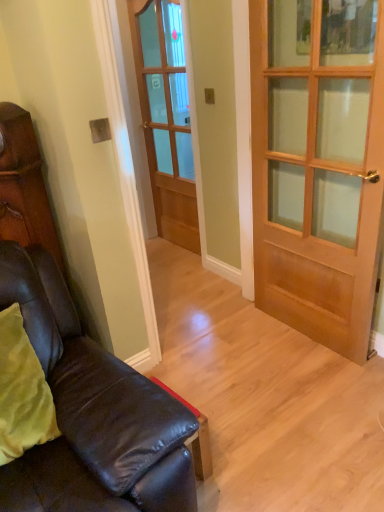
Identify the location of matte brown cabinet at left. The image size is (384, 512). (24, 186).

Measure the distance between wooden door at center, arranged as the first door when viewed from the front, and camera.

They are 5.27 feet apart.

How much space does wooden door at center, which is counted as the first door, starting from the right, occupy vertically?

The height of wooden door at center, which is counted as the first door, starting from the right, is 5.57 feet.

Measure the distance between wooden glass door at center, which is counted as the second door, starting from the right, and camera.

The distance of wooden glass door at center, which is counted as the second door, starting from the right, from camera is 2.80 meters.

Where is `leather couch at lower left`? The height and width of the screenshot is (512, 384). leather couch at lower left is located at coordinates (91, 412).

Is leather couch at lower left situated inside wooden door at center, arranged as the first door when viewed from the front, or outside?

leather couch at lower left is not inside wooden door at center, arranged as the first door when viewed from the front, it's outside.

How different are the orientations of leather couch at lower left and wooden door at center, arranged as the first door when viewed from the front, in degrees?

They differ by 88.8 degrees in their facing directions.

In terms of width, does leather couch at lower left look wider or thinner when compared to wooden door at center, arranged as the first door when viewed from the front?

Considering their sizes, leather couch at lower left looks broader than wooden door at center, arranged as the first door when viewed from the front.

Considering the points (26, 467) and (338, 284), which point is in front, point (26, 467) or point (338, 284)?

The point (26, 467) is closer to the camera.

Considering the sizes of objects wooden glass door at center, the first door from the back, and leather couch at lower left in the image provided, who is wider, wooden glass door at center, the first door from the back, or leather couch at lower left?

Wider between the two is leather couch at lower left.

Which object is more forward, wooden glass door at center, which is counted as the second door, starting from the right, or leather couch at lower left?

Positioned in front is leather couch at lower left.

Could you tell me if wooden glass door at center, the first door from the back, is turned towards leather couch at lower left?

No, wooden glass door at center, the first door from the back, is not turned towards leather couch at lower left.

Where is `door that is the 2nd one when counting backward from the leather couch at lower left`? The image size is (384, 512). door that is the 2nd one when counting backward from the leather couch at lower left is located at coordinates (166, 117).

What's the angular difference between leather couch at lower left and wooden glass door at center, which is counted as the second door, starting from the right,'s facing directions?

89.7 degrees separate the facing orientations of leather couch at lower left and wooden glass door at center, which is counted as the second door, starting from the right.

Does leather couch at lower left have a greater width compared to wooden glass door at center, positioned as the 2th door in front-to-back order?

Yes.

Is leather couch at lower left located outside wooden glass door at center, the first door from the back?

That's correct, leather couch at lower left is outside of wooden glass door at center, the first door from the back.

Which is behind, point (125, 505) or point (158, 228)?

The point (158, 228) is more distant.

Is wooden door at center, arranged as the first door when viewed from the front, positioned far away from wooden glass door at center, the first door in the left-to-right sequence?

wooden door at center, arranged as the first door when viewed from the front, is far away from wooden glass door at center, the first door in the left-to-right sequence.

Which is in front, point (363, 298) or point (145, 133)?

The point (363, 298) is in front.

Considering the relative sizes of wooden door at center, arranged as the second door when viewed from the back, and wooden glass door at center, the first door in the left-to-right sequence, in the image provided, is wooden door at center, arranged as the second door when viewed from the back, taller than wooden glass door at center, the first door in the left-to-right sequence,?

Incorrect, the height of wooden door at center, arranged as the second door when viewed from the back, is not larger of that of wooden glass door at center, the first door in the left-to-right sequence.

From a real-world perspective, who is located lower, wooden door at center, arranged as the second door when viewed from the back, or wooden glass door at center, the first door from the back?

In real-world perspective, wooden door at center, arranged as the second door when viewed from the back, is lower.

From a real-world perspective, is matte brown cabinet at left positioned above or below leather couch at lower left?

In terms of real-world spatial position, matte brown cabinet at left is above leather couch at lower left.

Which of these two, matte brown cabinet at left or leather couch at lower left, stands taller?

Standing taller between the two is matte brown cabinet at left.

Is matte brown cabinet at left placed right next to leather couch at lower left?

No, matte brown cabinet at left is not making contact with leather couch at lower left.

Can you confirm if matte brown cabinet at left is thinner than leather couch at lower left?

Yes.

Considering the sizes of objects matte brown cabinet at left and wooden glass door at center, which is counted as the second door, starting from the right, in the image provided, who is wider, matte brown cabinet at left or wooden glass door at center, which is counted as the second door, starting from the right,?

With larger width is matte brown cabinet at left.

Between matte brown cabinet at left and wooden glass door at center, positioned as the 2th door in front-to-back order, which one is positioned in front?

matte brown cabinet at left is more forward.

Does point (2, 153) appear closer or farther from the camera than point (174, 133)?

Point (2, 153).

Which is more to the left, matte brown cabinet at left or wooden glass door at center, the first door from the back?

matte brown cabinet at left.

In the image, is wooden door at center, arranged as the second door when viewed from the back, on the left side or the right side of matte brown cabinet at left?

wooden door at center, arranged as the second door when viewed from the back, is positioned on matte brown cabinet at left's right side.

At what (x,y) coordinates should I click in order to perform the action: click on the 1st door above the matte brown cabinet at left (from the image's perspective). Please return your answer as a coordinate pair (x, y). Looking at the image, I should click on (315, 177).

In terms of width, does wooden door at center, which is counted as the first door, starting from the right, look wider or thinner when compared to matte brown cabinet at left?

wooden door at center, which is counted as the first door, starting from the right, is thinner than matte brown cabinet at left.

The height and width of the screenshot is (512, 384). Find the location of `studio couch below the wooden door at center, which is counted as the first door, starting from the right (from the image's perspective)`. studio couch below the wooden door at center, which is counted as the first door, starting from the right (from the image's perspective) is located at coordinates (91, 412).

At what (x,y) coordinates should I click in order to perform the action: click on studio couch lying on the right of wooden glass door at center, the first door from the back. Please return your answer as a coordinate pair (x, y). Looking at the image, I should click on (91, 412).

Which object lies further to the anchor point leather couch at lower left, matte brown cabinet at left or wooden glass door at center, the first door in the left-to-right sequence?

The object further to leather couch at lower left is wooden glass door at center, the first door in the left-to-right sequence.

Which object lies nearer to the anchor point leather couch at lower left, wooden glass door at center, which is counted as the second door, starting from the right, or matte brown cabinet at left?

matte brown cabinet at left lies closer to leather couch at lower left than the other object.

Estimate the real-world distances between objects in this image. Which object is closer to wooden glass door at center, positioned as the 2th door in front-to-back order, leather couch at lower left or wooden door at center, placed as the 2th door when sorted from left to right?

Based on the image, wooden door at center, placed as the 2th door when sorted from left to right, appears to be nearer to wooden glass door at center, positioned as the 2th door in front-to-back order.

Looking at the image, which one is located further to wooden door at center, placed as the 2th door when sorted from left to right, leather couch at lower left or wooden glass door at center, positioned as the 2th door in front-to-back order?

leather couch at lower left lies further to wooden door at center, placed as the 2th door when sorted from left to right, than the other object.

Looking at the image, which one is located further to matte brown cabinet at left, wooden door at center, placed as the 2th door when sorted from left to right, or wooden glass door at center, the first door from the back?

wooden glass door at center, the first door from the back, is positioned further to the anchor matte brown cabinet at left.

Considering their positions, is wooden glass door at center, which is counted as the second door, starting from the right, positioned further to matte brown cabinet at left than leather couch at lower left?

wooden glass door at center, which is counted as the second door, starting from the right, is positioned further to the anchor matte brown cabinet at left.

Based on their spatial positions, is leather couch at lower left or matte brown cabinet at left closer to wooden glass door at center, the first door from the back?

matte brown cabinet at left.

Looking at the image, which one is located closer to matte brown cabinet at left, leather couch at lower left or wooden door at center, arranged as the second door when viewed from the back?

The object closer to matte brown cabinet at left is leather couch at lower left.

Locate an element on the screen. The width and height of the screenshot is (384, 512). door positioned between leather couch at lower left and wooden glass door at center, positioned as the 2th door in front-to-back order, from near to far is located at coordinates (315, 177).

The height and width of the screenshot is (512, 384). What are the coordinates of `cabinetry positioned between leather couch at lower left and wooden glass door at center, positioned as the 2th door in front-to-back order, from near to far` in the screenshot? It's located at (24, 186).

Where is `door situated between matte brown cabinet at left and wooden door at center, arranged as the second door when viewed from the back, from left to right`? door situated between matte brown cabinet at left and wooden door at center, arranged as the second door when viewed from the back, from left to right is located at coordinates (166, 117).

At what (x,y) coordinates should I click in order to perform the action: click on studio couch between matte brown cabinet at left and wooden door at center, placed as the 2th door when sorted from left to right. Please return your answer as a coordinate pair (x, y). This screenshot has width=384, height=512. Looking at the image, I should click on (91, 412).